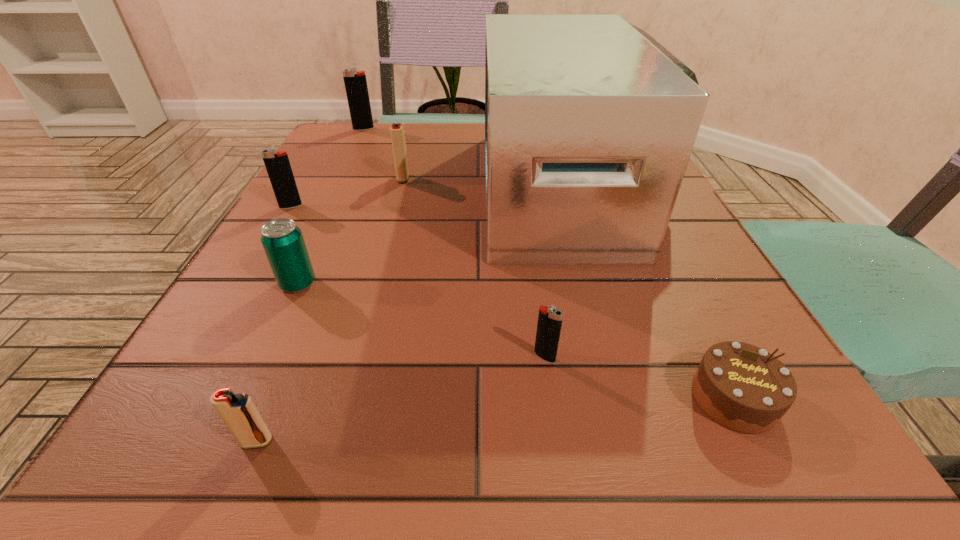
This screenshot has height=540, width=960. What are the coordinates of `vacant area that satisfies the following two spatial constraints: 1. on the front side of the fourth nearest object; 2. on the right side of the farthest igniter` in the screenshot? It's located at (287, 284).

The height and width of the screenshot is (540, 960). I want to click on vacant space that satisfies the following two spatial constraints: 1. on the front side of the brown chocolate cake; 2. on the right side of the second biggest black igniter, so click(175, 398).